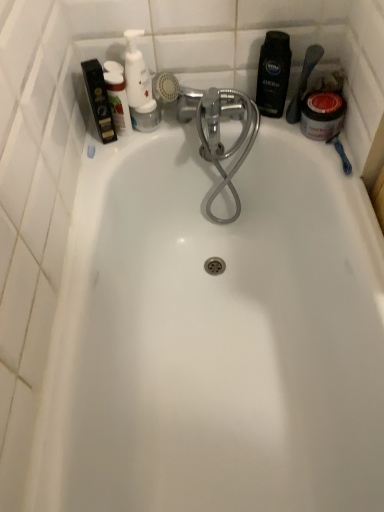
Question: Considering the positions of white glossy pump bottle at upper left, which is counted as the 2th toiletry, starting from the right, and white glossy pump bottle at upper left, the 3th toiletry viewed from the right, in the image, is white glossy pump bottle at upper left, which is counted as the 2th toiletry, starting from the right, taller or shorter than white glossy pump bottle at upper left, the 3th toiletry viewed from the right,?

Choices:
 (A) tall
 (B) short

Answer: (A)

Question: Considering the positions of white glossy pump bottle at upper left, which is counted as the second toiletry, starting from the left, and white glossy pump bottle at upper left, the 3th toiletry viewed from the right, in the image, is white glossy pump bottle at upper left, which is counted as the second toiletry, starting from the left, wider or thinner than white glossy pump bottle at upper left, the 3th toiletry viewed from the right,?

Choices:
 (A) thin
 (B) wide

Answer: (B)

Question: Based on their relative distances, which object is farther from the white glossy pump bottle at upper left, acting as the 1th toiletry starting from the left?

Choices:
 (A) white glossy pump bottle at upper left, which is counted as the 2th toiletry, starting from the right
 (B) deep black shampoo at upper right, acting as the first toiletry starting from the right
 (C) matte black jar at upper right

Answer: (C)

Question: Estimate the real-world distances between objects in this image. Which object is farther from the deep black shampoo at upper right, acting as the first toiletry starting from the right?

Choices:
 (A) white glossy pump bottle at upper left, which is counted as the 2th toiletry, starting from the right
 (B) matte black jar at upper right
 (C) white glossy pump bottle at upper left, acting as the 1th toiletry starting from the left

Answer: (C)